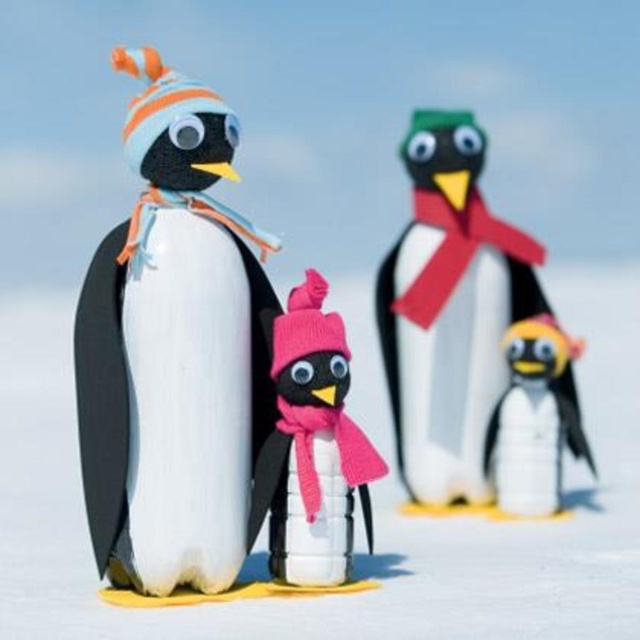
Who is positioned more to the left, matte black penguin at center or pink knitted hat at center?

pink knitted hat at center

You are a GUI agent. You are given a task and a screenshot of the screen. Output one action in this format:
    pyautogui.click(x=<x>, y=<y>)
    Task: Click on the matte black penguin at center
    
    Given the screenshot: What is the action you would take?
    pyautogui.click(x=451, y=310)

Identify the location of matte black penguin at center. (451, 310).

Is white matte snow at center smaller than matte black penguin at left?

Incorrect, white matte snow at center is not smaller in size than matte black penguin at left.

Who is higher up, white matte snow at center or matte black penguin at left?

matte black penguin at left

Who is more distant from viewer, (580, 588) or (170, 102)?

Point (170, 102)

Identify the location of white matte snow at center. (356, 506).

Is pink knitted hat at center above matte yellow penguin at lower right?

Yes, pink knitted hat at center is above matte yellow penguin at lower right.

Can you confirm if pink knitted hat at center is positioned to the left of matte yellow penguin at lower right?

Indeed, pink knitted hat at center is positioned on the left side of matte yellow penguin at lower right.

The width and height of the screenshot is (640, 640). What do you see at coordinates (310, 448) in the screenshot? I see `pink knitted hat at center` at bounding box center [310, 448].

Identify the location of pink knitted hat at center. (310, 448).